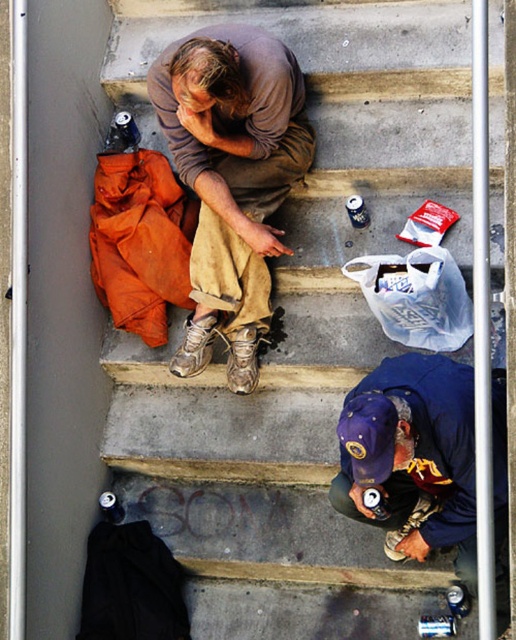
Question: Which point is farther to the camera?

Choices:
 (A) brown leather boot at center
 (B) blue fabric cap at lower center
 (C) brown leather shoe at center

Answer: (A)

Question: Which point appears farthest from the camera in this image?

Choices:
 (A) (443, 396)
 (B) (440, 504)
 (C) (232, 163)
 (D) (258, 330)

Answer: (D)

Question: Is blue fabric cap at lower center bigger than brown leather boot at center?

Choices:
 (A) yes
 (B) no

Answer: (A)

Question: Does brown cotton shirt at center have a smaller size compared to brown leather boot at center?

Choices:
 (A) yes
 (B) no

Answer: (B)

Question: Can you confirm if brown leather shoe at center is thinner than brown leather boot at center?

Choices:
 (A) no
 (B) yes

Answer: (A)

Question: Which point is closer to the camera?

Choices:
 (A) brown suede shoe at lower center
 (B) brown leather boot at center
 (C) brown cotton shirt at center
 (D) blue fabric cap at lower center

Answer: (D)